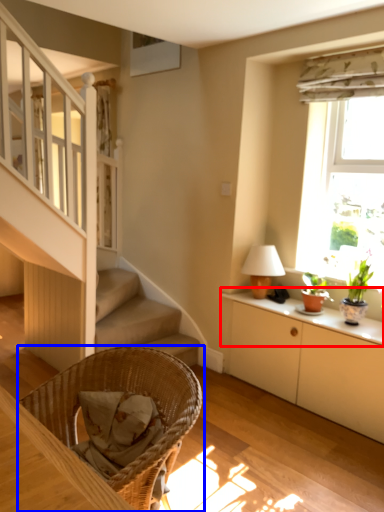
Question: Which object appears closest to the camera in this image, window sill (highlighted by a red box) or chair (highlighted by a blue box)?

Choices:
 (A) window sill
 (B) chair

Answer: (B)